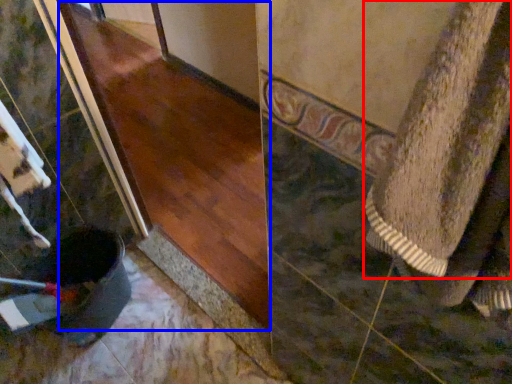
Question: Which object is further to the camera taking this photo, towel (highlighted by a red box) or wood (highlighted by a blue box)?

Choices:
 (A) towel
 (B) wood

Answer: (B)